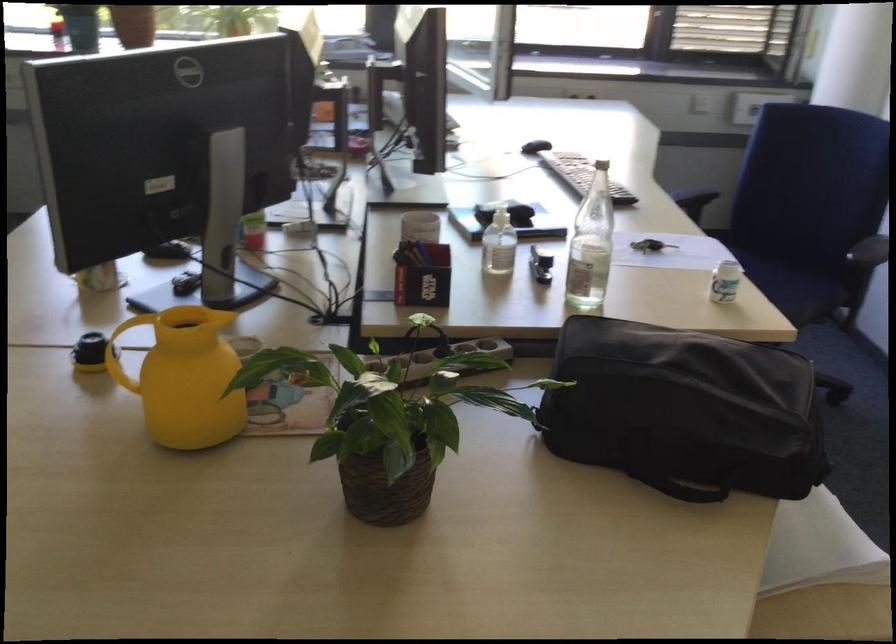
The location [590,245] corresponds to which object?

It refers to a glass water bottle.